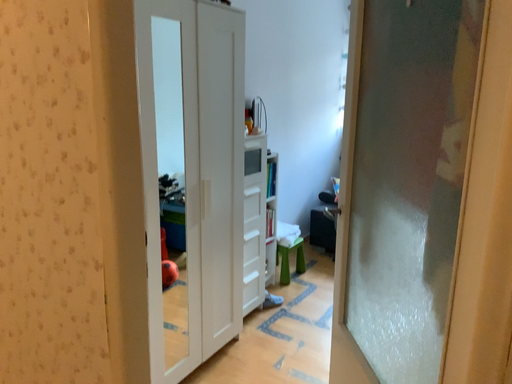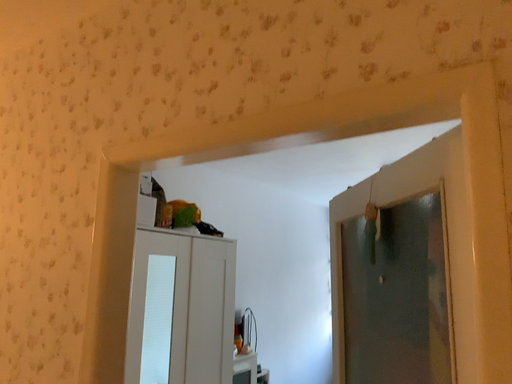
Question: Which way did the camera rotate in the video?

Choices:
 (A) rotated downward
 (B) rotated upward

Answer: (B)